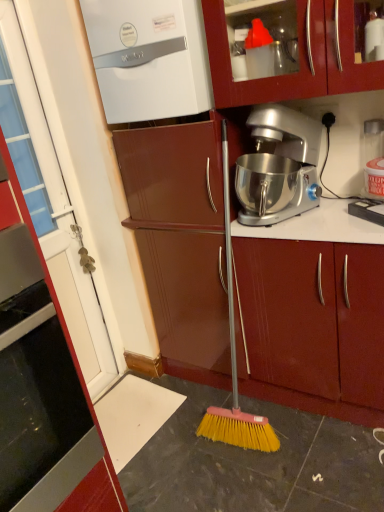
This screenshot has width=384, height=512. What are the coordinates of `vacant space in silver metallic stand mixer at center (from a real-world perspective)` in the screenshot? It's located at (281, 222).